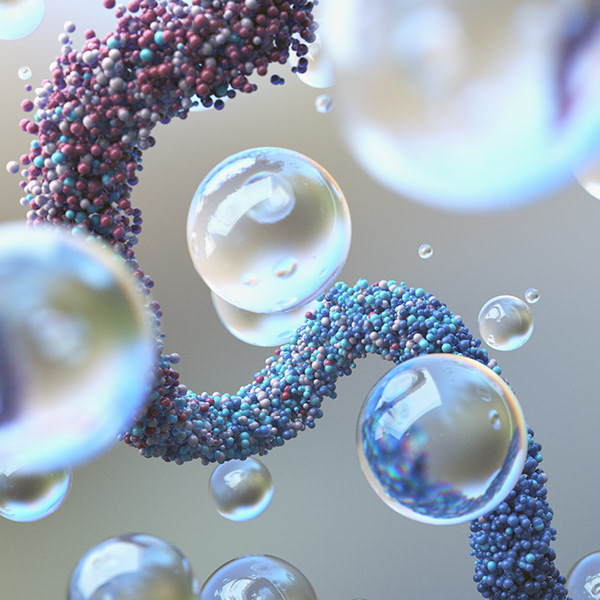
Where is `wall`? This screenshot has width=600, height=600. wall is located at coordinates pyautogui.click(x=190, y=310).